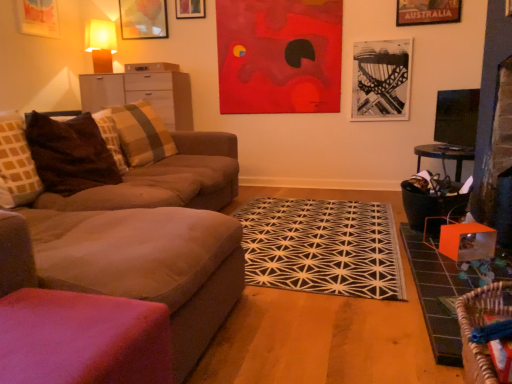
Question: Is matte wood cabinet at left looking in the opposite direction of suede-like beige couch at left, arranged as the first studio couch when viewed from the front?

Choices:
 (A) no
 (B) yes

Answer: (A)

Question: Can you confirm if matte wood cabinet at left is shorter than suede-like beige couch at left, arranged as the first studio couch when viewed from the front?

Choices:
 (A) no
 (B) yes

Answer: (B)

Question: Could you tell me if matte wood cabinet at left is facing suede-like beige couch at left, the second studio couch from the back?

Choices:
 (A) no
 (B) yes

Answer: (B)

Question: Is matte wood cabinet at left further to the viewer compared to suede-like beige couch at left, arranged as the first studio couch when viewed from the front?

Choices:
 (A) no
 (B) yes

Answer: (B)

Question: Is matte wood cabinet at left outside suede-like beige couch at left, arranged as the first studio couch when viewed from the front?

Choices:
 (A) yes
 (B) no

Answer: (A)

Question: From the image's perspective, is matte wood cabinet at left on suede-like beige couch at left, the second studio couch from the back?

Choices:
 (A) yes
 (B) no

Answer: (A)

Question: Is woven wood swivel chair at lower right smaller than brown textured pillow at left, positioned as the 1th pillow in front-to-back order?

Choices:
 (A) no
 (B) yes

Answer: (B)

Question: Is woven wood swivel chair at lower right facing away from brown textured pillow at left, the 2th pillow in the back-to-front sequence?

Choices:
 (A) no
 (B) yes

Answer: (A)

Question: Is woven wood swivel chair at lower right surrounding brown textured pillow at left, positioned as the 1th pillow in front-to-back order?

Choices:
 (A) yes
 (B) no

Answer: (B)

Question: Would you say woven wood swivel chair at lower right is a long distance from brown textured pillow at left, the 2th pillow in the back-to-front sequence?

Choices:
 (A) no
 (B) yes

Answer: (B)

Question: Considering the relative sizes of woven wood swivel chair at lower right and brown textured pillow at left, the 2th pillow in the back-to-front sequence, in the image provided, is woven wood swivel chair at lower right bigger than brown textured pillow at left, the 2th pillow in the back-to-front sequence,?

Choices:
 (A) no
 (B) yes

Answer: (A)

Question: Does woven wood swivel chair at lower right have a lesser width compared to brown textured pillow at left, the 2th pillow in the back-to-front sequence?

Choices:
 (A) yes
 (B) no

Answer: (A)

Question: From the image's perspective, is matte wood cabinet at left under matte glass picture frame at upper left, which is the 3th picture frame from right to left?

Choices:
 (A) yes
 (B) no

Answer: (A)